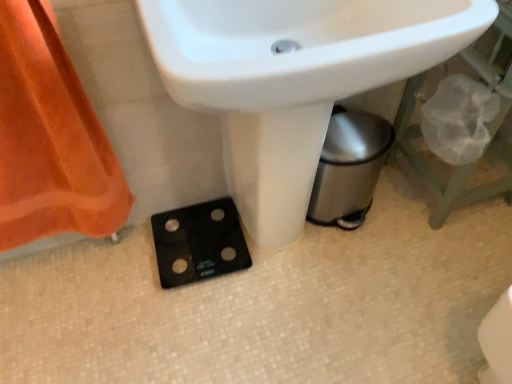
At what (x,y) coordinates should I click in order to perform the action: click on vacant area that lies between white glossy sink at center and orange fabric at left. Please return your answer as a coordinate pair (x, y). Looking at the image, I should click on (119, 289).